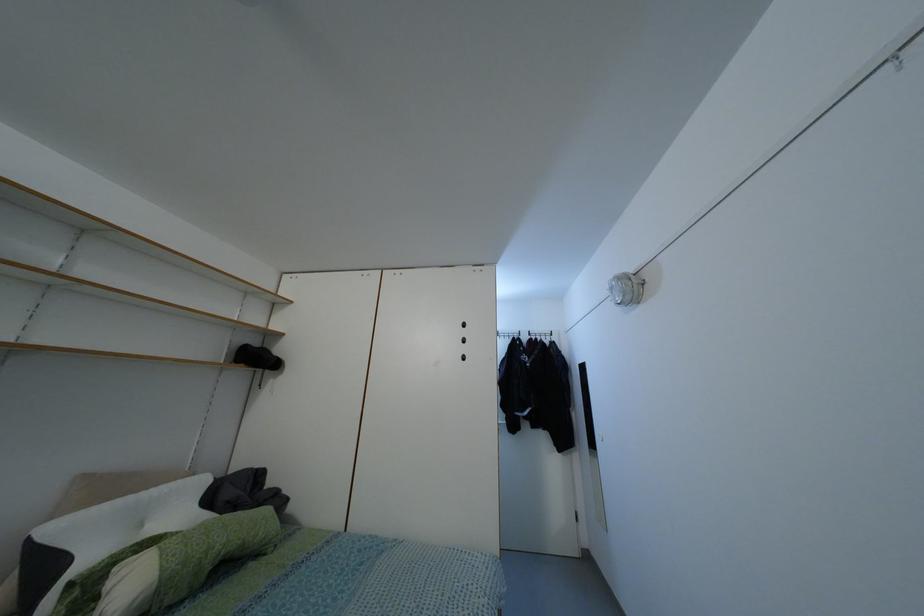
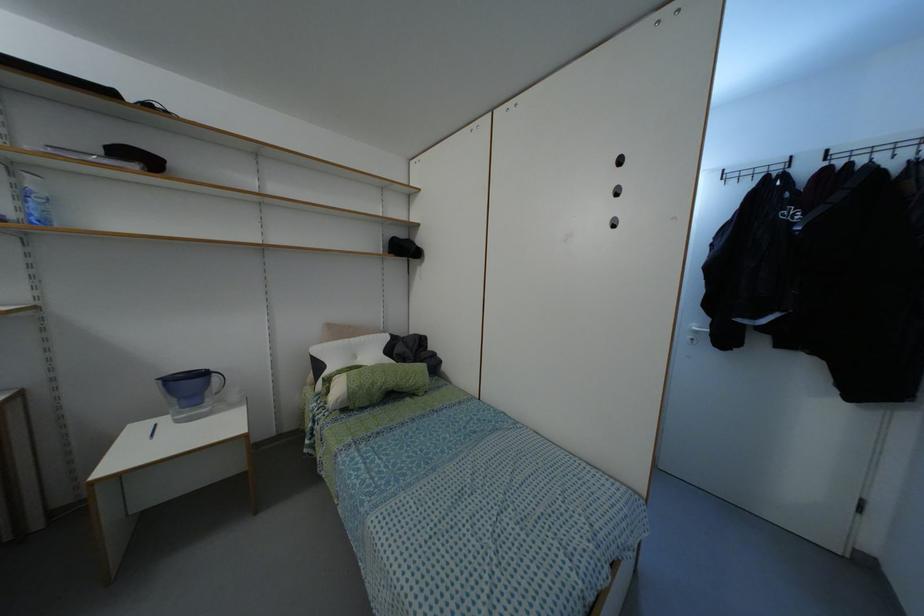
The images are taken continuously from a first-person perspective. In which direction is your viewpoint rotating?

The rotation direction of the camera is left-down.